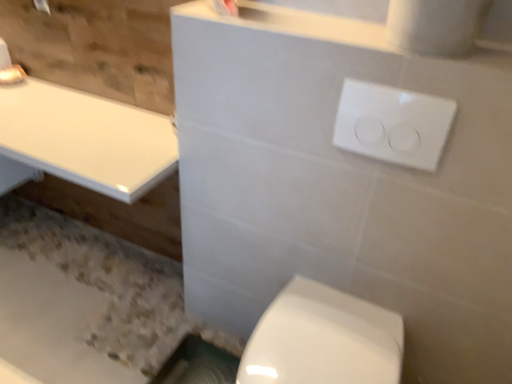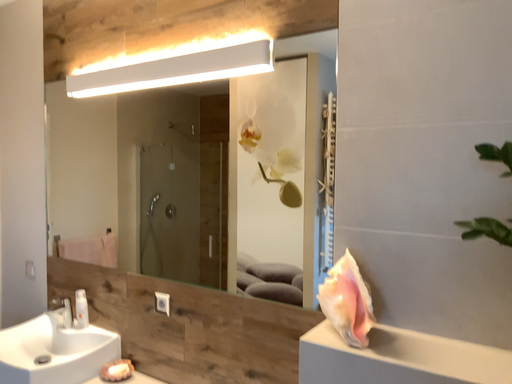
Question: Which way did the camera rotate in the video?

Choices:
 (A) rotated downward
 (B) rotated upward

Answer: (B)